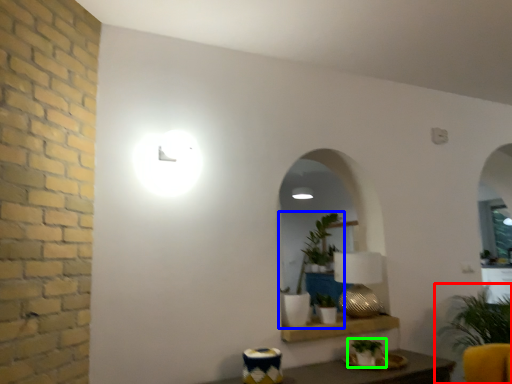
Question: Which object is the farthest from houseplant (highlighted by a red box)? Choose among these: houseplant (highlighted by a blue box) or houseplant (highlighted by a green box).

Choices:
 (A) houseplant
 (B) houseplant

Answer: (A)